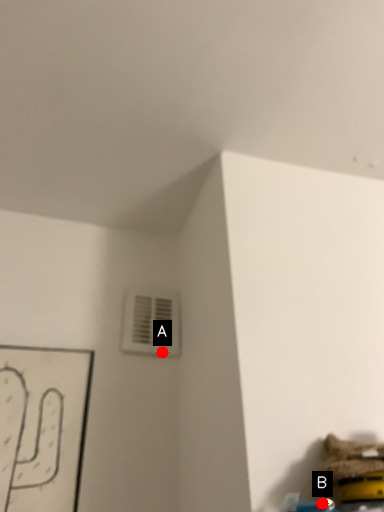
Question: Two points are circled on the image, labeled by A and B beside each circle. Which point is closer to the camera?

Choices:
 (A) A is closer
 (B) B is closer

Answer: (B)